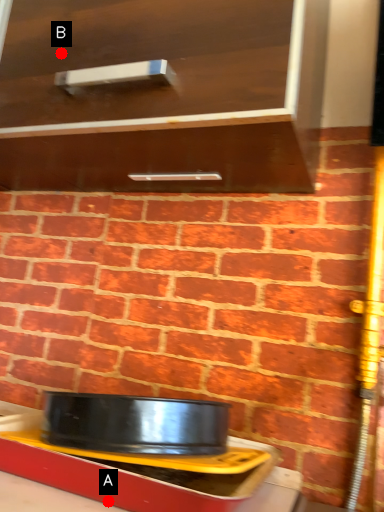
Question: Two points are circled on the image, labeled by A and B beside each circle. Which of the following is the closest to the observer?

Choices:
 (A) A is closer
 (B) B is closer

Answer: (A)